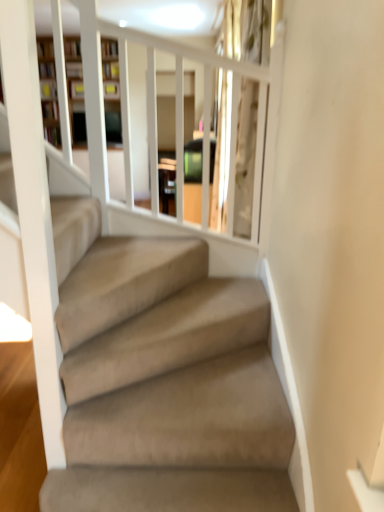
Describe the element at coordinates (75, 90) in the screenshot. The width and height of the screenshot is (384, 512). I see `wooden bookshelf at upper left` at that location.

The height and width of the screenshot is (512, 384). What are the coordinates of `wooden bookshelf at upper left` in the screenshot? It's located at (75, 90).

Image resolution: width=384 pixels, height=512 pixels. I want to click on clear glass door at upper center, so (245, 157).

Describe the element at coordinates (245, 157) in the screenshot. I see `clear glass door at upper center` at that location.

The height and width of the screenshot is (512, 384). Find the location of `wooden bookshelf at upper left`. wooden bookshelf at upper left is located at coordinates (75, 90).

Would you say wooden bookshelf at upper left is to the left or to the right of clear glass door at upper center in the picture?

wooden bookshelf at upper left is positioned on clear glass door at upper center's left side.

Who is more distant, wooden bookshelf at upper left or clear glass door at upper center?

Positioned behind is wooden bookshelf at upper left.

Between point (74, 55) and point (244, 50), which one is positioned in front?

Positioned in front is point (74, 55).

In the scene shown: From the image's perspective, is wooden bookshelf at upper left located above or below clear glass door at upper center?

wooden bookshelf at upper left is above clear glass door at upper center.

From a real-world perspective, is wooden bookshelf at upper left positioned above or below clear glass door at upper center?

wooden bookshelf at upper left is above clear glass door at upper center.

Does wooden bookshelf at upper left have a lesser width compared to clear glass door at upper center?

No.

In the scene shown: Which of these two, wooden bookshelf at upper left or clear glass door at upper center, stands shorter?

clear glass door at upper center.

Which of these two, wooden bookshelf at upper left or clear glass door at upper center, is bigger?

wooden bookshelf at upper left is bigger.

Is clear glass door at upper center completely or partially inside wooden bookshelf at upper left?

No, clear glass door at upper center is located outside of wooden bookshelf at upper left.

Can you see wooden bookshelf at upper left touching clear glass door at upper center?

There is a gap between wooden bookshelf at upper left and clear glass door at upper center.

Does wooden bookshelf at upper left turn towards clear glass door at upper center?

Yes, wooden bookshelf at upper left is oriented towards clear glass door at upper center.

I want to click on bookshelf lying behind the clear glass door at upper center, so pyautogui.click(x=75, y=90).

Considering the positions of objects clear glass door at upper center and wooden bookshelf at upper left in the image provided, who is more to the left, clear glass door at upper center or wooden bookshelf at upper left?

Positioned to the left is wooden bookshelf at upper left.

Relative to wooden bookshelf at upper left, is clear glass door at upper center in front or behind?

Visually, clear glass door at upper center is located in front of wooden bookshelf at upper left.

Which is less distant, (265, 53) or (42, 71)?

Point (265, 53) appears to be closer to the viewer than point (42, 71).

From the image's perspective, between clear glass door at upper center and wooden bookshelf at upper left, which one is located above?

wooden bookshelf at upper left, from the image's perspective.

From a real-world perspective, between clear glass door at upper center and wooden bookshelf at upper left, who is vertically higher?

wooden bookshelf at upper left, from a real-world perspective.

Is clear glass door at upper center thinner than wooden bookshelf at upper left?

Yes.

In the scene shown: From their relative heights in the image, would you say clear glass door at upper center is taller or shorter than wooden bookshelf at upper left?

Clearly, clear glass door at upper center is shorter compared to wooden bookshelf at upper left.

Is clear glass door at upper center bigger or smaller than wooden bookshelf at upper left?

In the image, clear glass door at upper center appears to be smaller than wooden bookshelf at upper left.

Is clear glass door at upper center surrounding wooden bookshelf at upper left?

Actually, wooden bookshelf at upper left is outside clear glass door at upper center.

Is clear glass door at upper center far away from wooden bookshelf at upper left?

clear glass door at upper center is actually quite close to wooden bookshelf at upper left.

Is clear glass door at upper center aimed at wooden bookshelf at upper left?

No, clear glass door at upper center does not turn towards wooden bookshelf at upper left.

From the picture: How many degrees apart are the facing directions of clear glass door at upper center and wooden bookshelf at upper left?

There is a 85.6-degree angle between the facing directions of clear glass door at upper center and wooden bookshelf at upper left.

Measure the distance between clear glass door at upper center and wooden bookshelf at upper left.

clear glass door at upper center and wooden bookshelf at upper left are 28.72 inches apart from each other.

There is a clear glass door at upper center. Find the location of `bookshelf above it (from a real-world perspective)`. bookshelf above it (from a real-world perspective) is located at coordinates (75, 90).

I want to click on bookshelf that is behind the clear glass door at upper center, so click(x=75, y=90).

Where is `glass door that appears in front of the wooden bookshelf at upper left`? glass door that appears in front of the wooden bookshelf at upper left is located at coordinates (245, 157).